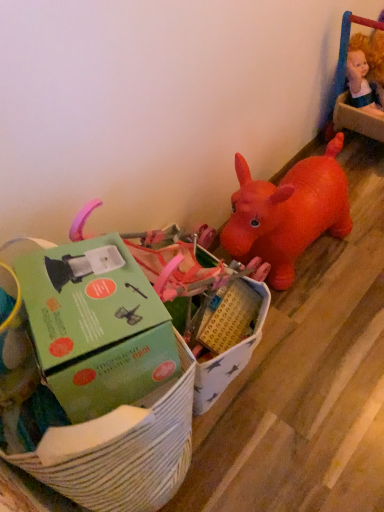
Question: Considering the positions of smooth plastic doll at upper right, placed as the first toy when sorted from top to bottom, and green cardboard box at center, which is the second toy in right-to-left order, in the image, is smooth plastic doll at upper right, placed as the first toy when sorted from top to bottom, bigger or smaller than green cardboard box at center, which is the second toy in right-to-left order,?

Choices:
 (A) big
 (B) small

Answer: (B)

Question: Which is correct: smooth plastic doll at upper right, the first toy from the back, is inside green cardboard box at center, which is the 1th toy in front-to-back order, or outside of it?

Choices:
 (A) inside
 (B) outside

Answer: (B)

Question: Which object is positioned farthest from the green cardboard box at center, which is the 1th toy from left to right?

Choices:
 (A) green cardboard box at lower left
 (B) smooth plastic doll at upper right, acting as the 1th toy starting from the right

Answer: (B)

Question: Estimate the real-world distances between objects in this image. Which object is closer to the green cardboard box at center, which is the 1th toy in front-to-back order?

Choices:
 (A) smooth plastic doll at upper right, which is the second toy in left-to-right order
 (B) green cardboard box at lower left

Answer: (B)